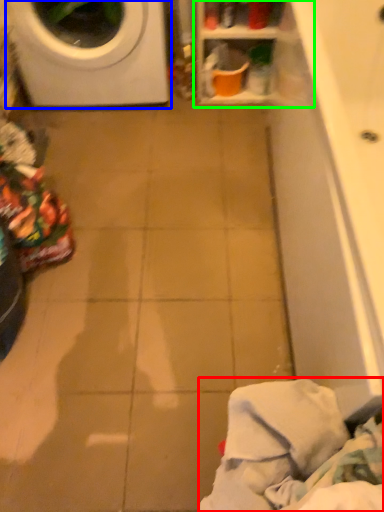
Question: Estimate the real-world distances between objects in this image. Which object is farther from clothing (highlighted by a red box), washing machine (highlighted by a blue box) or shelf (highlighted by a green box)?

Choices:
 (A) washing machine
 (B) shelf

Answer: (A)